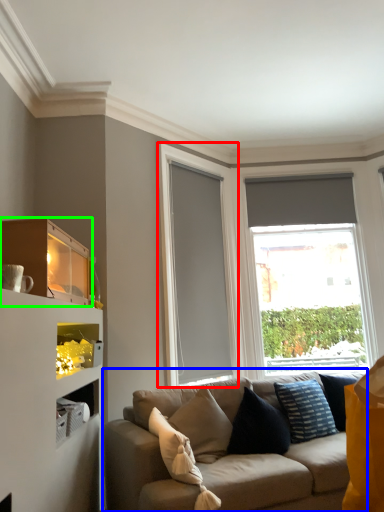
Question: Based on their relative distances, which object is farther from glass door (highlighted by a red box)? Choose from studio couch (highlighted by a blue box) and shelf (highlighted by a green box).

Choices:
 (A) studio couch
 (B) shelf

Answer: (B)